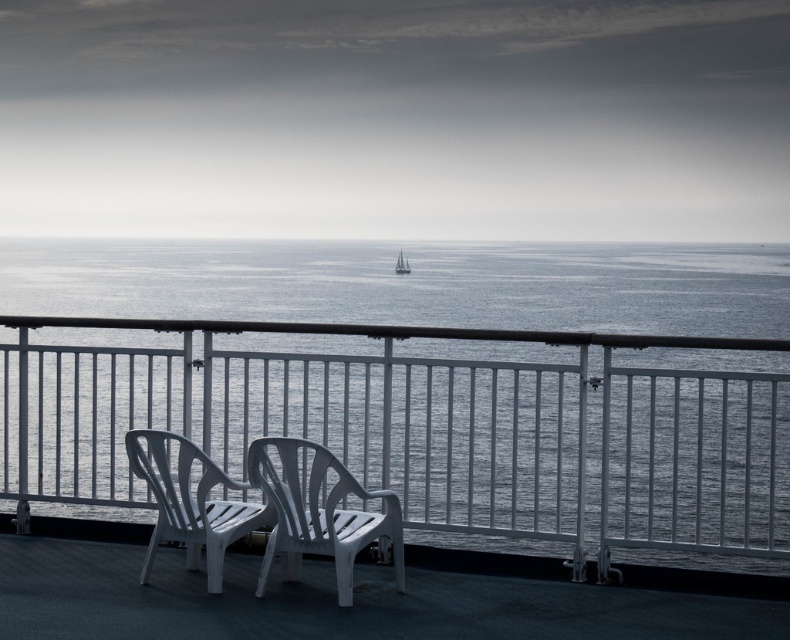
Can you confirm if white plastic chair at center is positioned to the right of white sailboat at center?

No, white plastic chair at center is not to the right of white sailboat at center.

Does point (325, 508) come behind point (408, 264)?

That is False.

In order to click on white plastic chair at center in this screenshot , I will do (x=318, y=512).

Can you confirm if gray water at center is wider than white plastic chairs at center?

Yes.

Is gray water at center to the left of white plastic chairs at center from the viewer's perspective?

Indeed, gray water at center is positioned on the left side of white plastic chairs at center.

Which is behind, point (333, 413) or point (36, 544)?

The point (36, 544) is more distant.

Identify the location of gray water at center. (422, 378).

Who is more distant from viewer, [194,513] or [401,262]?

The point [401,262] is behind.

I want to click on white plastic chair at lower left, so click(x=190, y=500).

Is point (202, 525) more distant than point (403, 262)?

No, (202, 525) is closer to viewer.

You are a GUI agent. You are given a task and a screenshot of the screen. Output one action in this format:
    pyautogui.click(x=<x>, y=<y>)
    Task: Click on the white plastic chair at lower left
    This screenshot has width=790, height=640.
    Given the screenshot: What is the action you would take?
    pyautogui.click(x=190, y=500)